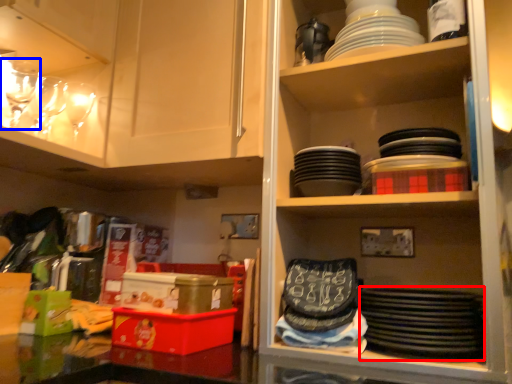
Question: Which object appears farthest to the camera in this image, platter (highlighted by a red box) or tableware (highlighted by a blue box)?

Choices:
 (A) platter
 (B) tableware

Answer: (B)